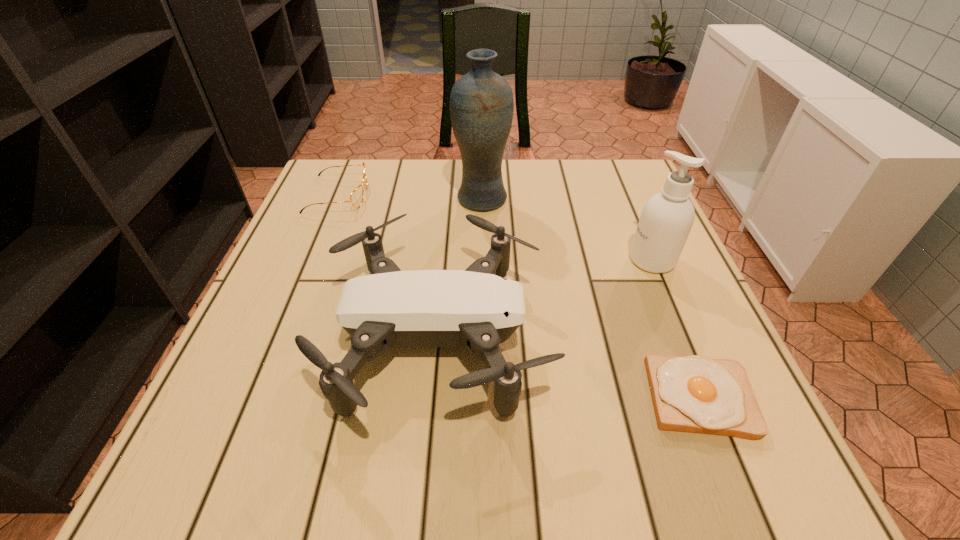
This screenshot has height=540, width=960. Identify the location of the tallest object. (481, 102).

This screenshot has width=960, height=540. I want to click on the second tallest object, so click(x=667, y=217).

Where is `drone`? Image resolution: width=960 pixels, height=540 pixels. drone is located at coordinates (477, 308).

The image size is (960, 540). Identify the location of the leftmost object. (356, 198).

Find the location of `the second shortest object`. the second shortest object is located at coordinates (356, 198).

Locate an element on the screen. the shortest object is located at coordinates (695, 394).

This screenshot has height=540, width=960. I want to click on vacant space located on the left of the tallest object, so click(345, 199).

You are a GUI agent. You are given a task and a screenshot of the screen. Output one action in this format:
    pyautogui.click(x=<x>, y=<y>)
    Task: Click on the free space located 0.080m on the front label of the fourth shortest object
    This screenshot has height=540, width=960.
    Given the screenshot: What is the action you would take?
    pyautogui.click(x=592, y=260)

Identify the location of vacant space situated 0.080m on the front label of the fourth shortest object. The width and height of the screenshot is (960, 540). (592, 260).

The height and width of the screenshot is (540, 960). I want to click on free region located on the front label of the fourth shortest object, so click(x=584, y=260).